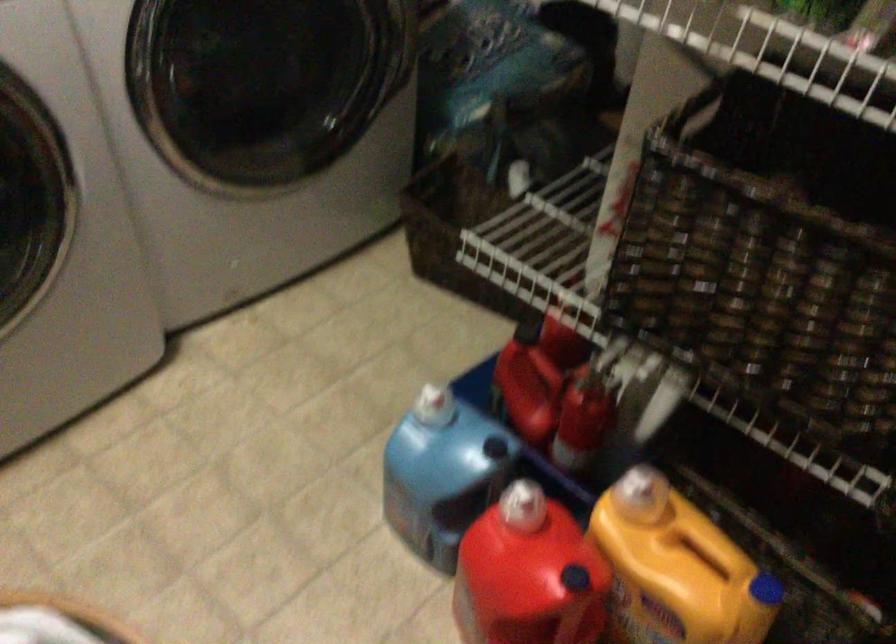
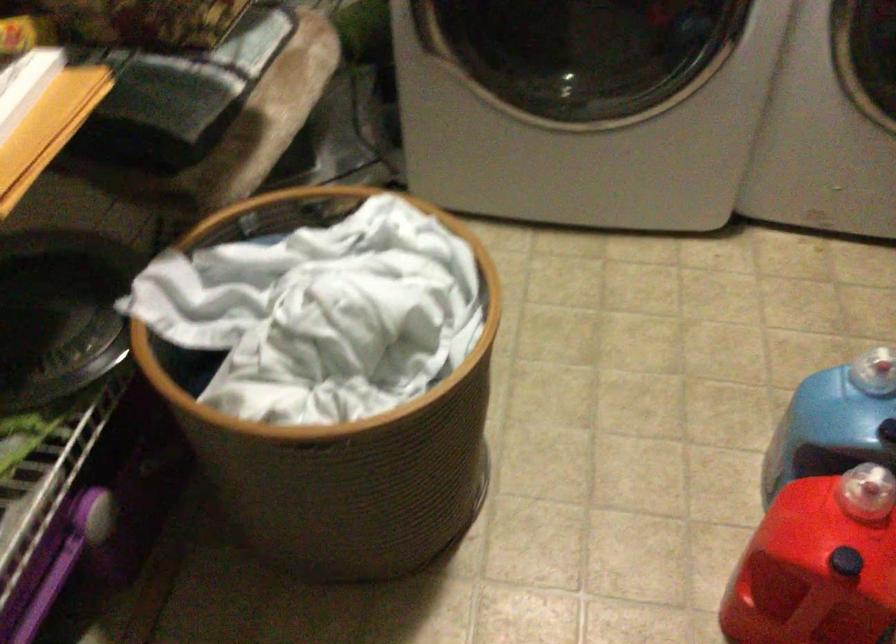
The point at (564, 567) is marked in the first image. Where is the corresponding point in the second image?

(846, 562)